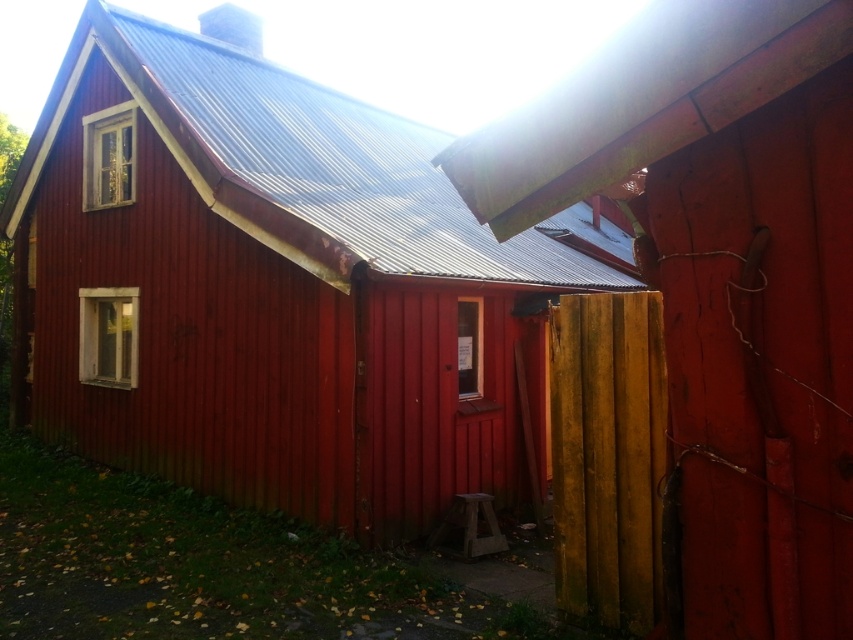
Question: Which object is the farthest from the yellow wood fence at right?

Choices:
 (A) smooth wooden cabin at center
 (B) wooden planks at right

Answer: (A)

Question: Can you confirm if wooden planks at right is positioned to the left of yellow wood fence at right?

Choices:
 (A) no
 (B) yes

Answer: (A)

Question: Is wooden planks at right bigger than yellow wood fence at right?

Choices:
 (A) yes
 (B) no

Answer: (A)

Question: Which point is farther to the camera?

Choices:
 (A) yellow wood fence at right
 (B) wooden planks at right

Answer: (A)

Question: Which point is farther to the camera?

Choices:
 (A) yellow wood fence at right
 (B) smooth wooden cabin at center

Answer: (B)

Question: Can you confirm if smooth wooden cabin at center is positioned to the left of wooden planks at right?

Choices:
 (A) no
 (B) yes

Answer: (B)